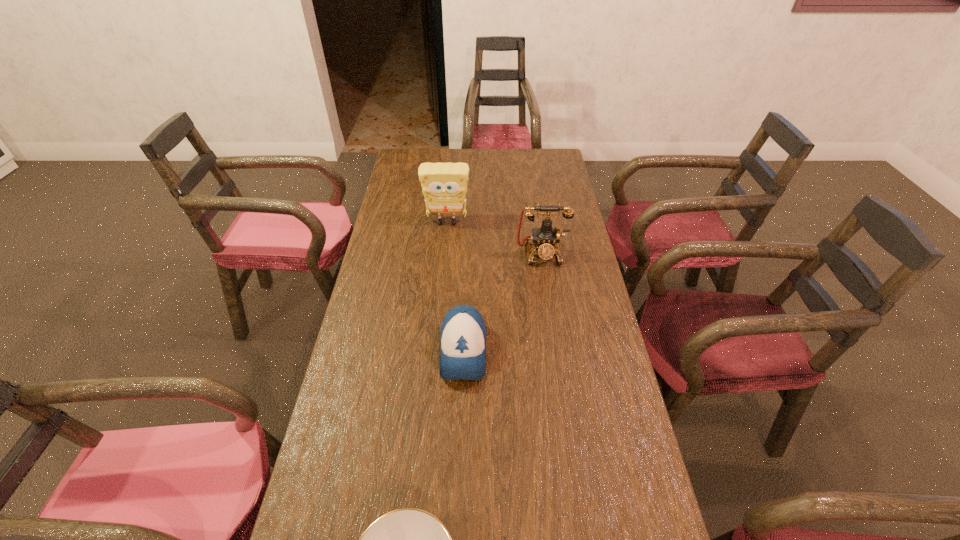
Find the location of a particular element. The height and width of the screenshot is (540, 960). free space at the left edge of the desktop is located at coordinates (375, 285).

Where is `blank area at the right edge`? The width and height of the screenshot is (960, 540). blank area at the right edge is located at coordinates (557, 281).

The image size is (960, 540). In order to click on free space at the far left corner of the desktop in this screenshot , I will do `click(408, 153)`.

In the image, there is a desktop. Identify the location of vacant space at the far right corner. The image size is (960, 540). (562, 168).

You are a GUI agent. You are given a task and a screenshot of the screen. Output one action in this format:
    pyautogui.click(x=<x>, y=<y>)
    Task: Click on the vacant area that lies between the second farthest object and the third farthest object
    
    Given the screenshot: What is the action you would take?
    pyautogui.click(x=502, y=302)

Locate an element on the screen. The image size is (960, 540). vacant point located between the sponge and the third farthest object is located at coordinates (455, 287).

The height and width of the screenshot is (540, 960). Find the location of `free space between the sponge and the third farthest object`. free space between the sponge and the third farthest object is located at coordinates (455, 287).

Identify the location of vacant area between the baseball cap and the rightmost object. The height and width of the screenshot is (540, 960). (502, 302).

Find the location of a particular element. Image resolution: width=960 pixels, height=540 pixels. free area in between the rightmost object and the baseball cap is located at coordinates pyautogui.click(x=502, y=302).

Image resolution: width=960 pixels, height=540 pixels. I want to click on free spot between the third nearest object and the third farthest object, so click(x=502, y=302).